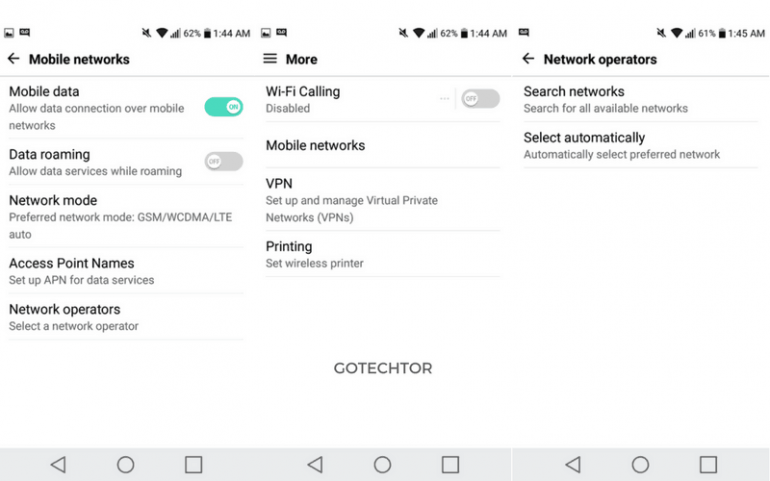
In order to click on toggle switch in this screenshot , I will do `click(231, 160)`, `click(216, 106)`, `click(480, 99)`.